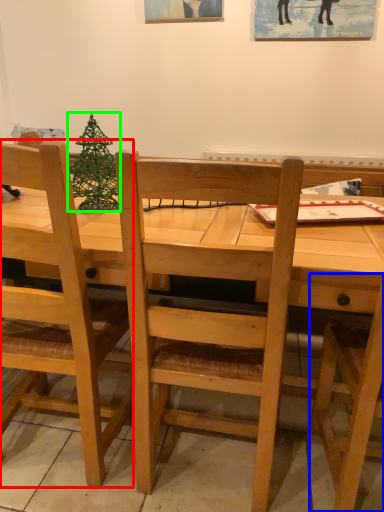
Question: Estimate the real-world distances between objects in this image. Which object is farther from chair (highlighted by a red box), chair (highlighted by a blue box) or christmas tree (highlighted by a green box)?

Choices:
 (A) chair
 (B) christmas tree

Answer: (A)